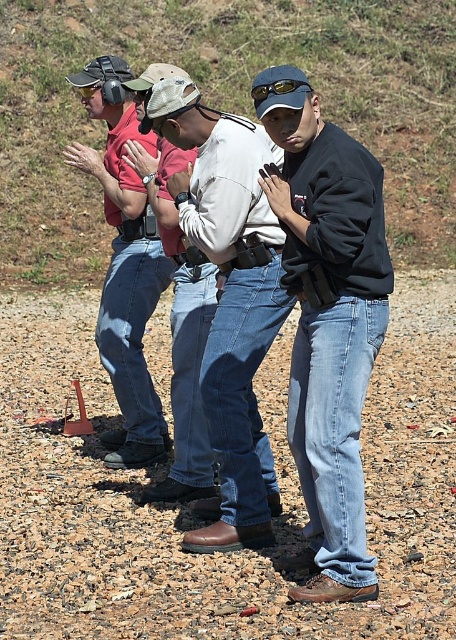
Question: Which of the following is the farthest from the observer?

Choices:
 (A) (119, 72)
 (B) (259, 273)
 (C) (25, 307)
 (D) (325, 154)

Answer: (C)

Question: Is brown leather boots at center positioned behind matte black shirt at left?

Choices:
 (A) no
 (B) yes

Answer: (A)

Question: Is dirt gravel at lower center to the right of black matte jacket at center from the viewer's perspective?

Choices:
 (A) yes
 (B) no

Answer: (B)

Question: Among these points, which one is farthest from the camera?

Choices:
 (A) click(52, 328)
 (B) click(205, 544)
 (C) click(257, 97)

Answer: (A)

Question: Is matte black shirt at left below sunglassestransparent at center?

Choices:
 (A) yes
 (B) no

Answer: (A)

Question: Among these points, which one is nearest to the camera?

Choices:
 (A) (385, 346)
 (B) (301, 102)
 (C) (108, 435)

Answer: (B)